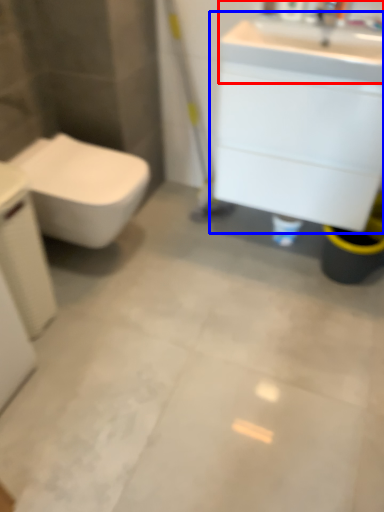
Question: Which of the following is the closest to the observer, sink (highlighted by a red box) or bathroom cabinet (highlighted by a blue box)?

Choices:
 (A) sink
 (B) bathroom cabinet

Answer: (A)